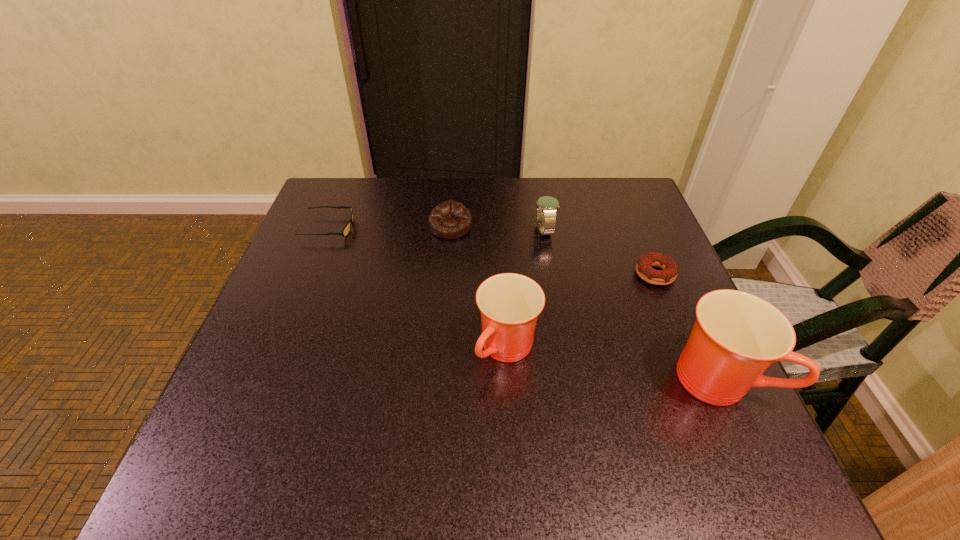
I want to click on vacant space that satisfies the following two spatial constraints: 1. on the front side of the watch; 2. on the right side of the third nearest object, so click(x=552, y=274).

Where is `vacant space that satisfies the following two spatial constraints: 1. on the front-facing side of the leftmost object; 2. on the left side of the third nearest object`? The height and width of the screenshot is (540, 960). vacant space that satisfies the following two spatial constraints: 1. on the front-facing side of the leftmost object; 2. on the left side of the third nearest object is located at coordinates point(310,274).

Find the location of a particular element. The width and height of the screenshot is (960, 540). blank area in the image that satisfies the following two spatial constraints: 1. on the front-facing side of the sunglasses; 2. on the back side of the fourth shortest object is located at coordinates (328, 231).

Locate an element on the screen. This screenshot has width=960, height=540. vacant region that satisfies the following two spatial constraints: 1. on the front-facing side of the leftmost object; 2. on the right side of the third tallest object is located at coordinates (328, 231).

Locate an element on the screen. The image size is (960, 540). free space that satisfies the following two spatial constraints: 1. on the front side of the fourth farthest object; 2. on the left side of the taller cup is located at coordinates (698, 379).

Image resolution: width=960 pixels, height=540 pixels. In order to click on vacant region that satisfies the following two spatial constraints: 1. on the front-facing side of the leftmost object; 2. on the right side of the left cup in this screenshot , I will do `click(280, 349)`.

Where is `vacant position in the image that satisfies the following two spatial constraints: 1. on the front-facing side of the doughnut; 2. on the left side of the leftmost object`? The height and width of the screenshot is (540, 960). vacant position in the image that satisfies the following two spatial constraints: 1. on the front-facing side of the doughnut; 2. on the left side of the leftmost object is located at coordinates (310, 274).

This screenshot has height=540, width=960. I want to click on vacant space that satisfies the following two spatial constraints: 1. on the back side of the watch; 2. on the front-facing side of the leftmost object, so (x=544, y=227).

Locate an element on the screen. free location that satisfies the following two spatial constraints: 1. on the front side of the second tallest object; 2. on the left side of the taller cup is located at coordinates (509, 379).

I want to click on vacant position in the image that satisfies the following two spatial constraints: 1. on the front-facing side of the sunglasses; 2. on the back side of the taller cup, so click(x=269, y=379).